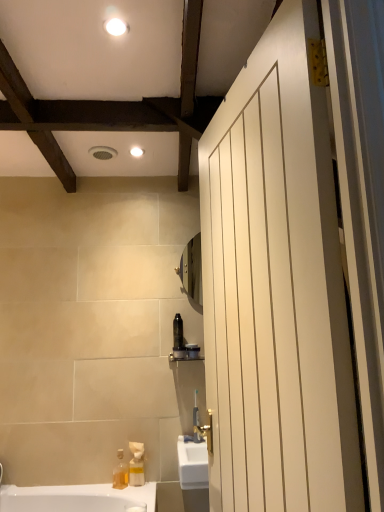
At what (x,y) coordinates should I click in order to perform the action: click on vacant space situated on the left part of white glossy light fixture at upper center, which is the first light fixture from top to bottom. Please return your answer as a coordinate pair (x, y). The height and width of the screenshot is (512, 384). Looking at the image, I should click on (72, 30).